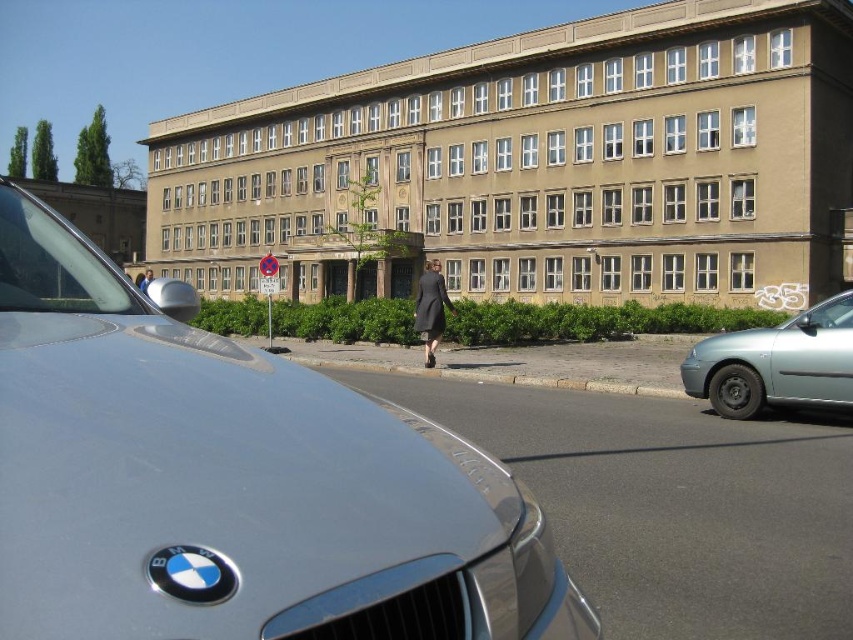
You are a delivery person needing to unload a package that requires a 10 meter space between vehicles. Can you safely unload here between the sleek silver car at center and the silver metallic sedan at right?

The sleek silver car at center is 8.21 meters from the silver metallic sedan at right, which is less than the required 10 meters. Therefore, you cannot safely unload here between the two vehicles.

You are standing at the entrance of the large, multi story building with a beige facade. You want to walk to the sleek silver car at center. Which direction should you walk to reach it?

You should walk towards the center of the image where the sleek silver car at center is located at point coordinates (231,481).

You are a delivery person trying to park your van next to the sleek silver car at center and the blue fabric jacket at center. Which object should you avoid hitting to ensure your van has enough space?

You should avoid hitting the blue fabric jacket at center because it is wider than the sleek silver car at center, so it requires more space.